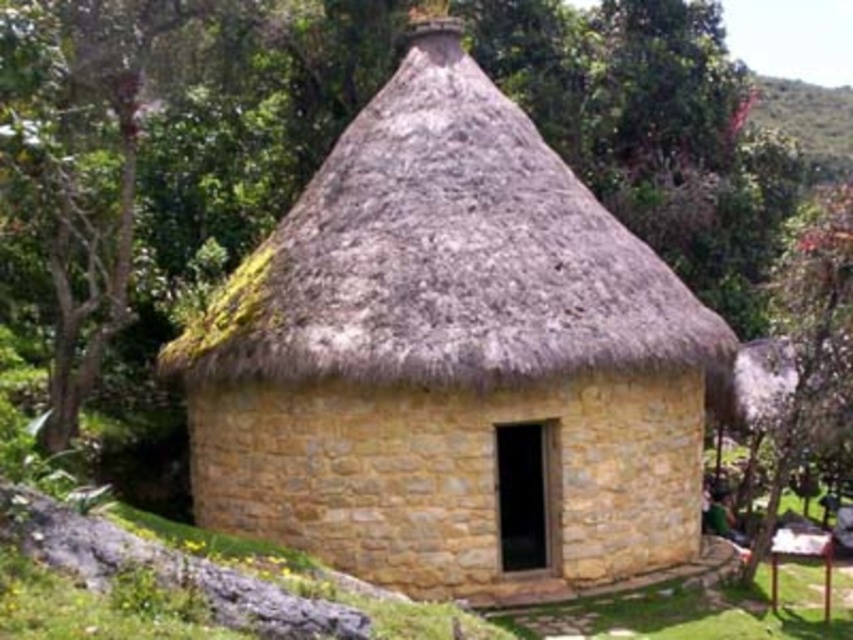
Question: Can you confirm if yellow stone hut at center is positioned above green leafy tree at upper right?

Choices:
 (A) no
 (B) yes

Answer: (A)

Question: In this image, where is yellow stone hut at center located relative to green leafy tree at upper right?

Choices:
 (A) left
 (B) right

Answer: (A)

Question: Does yellow stone hut at center have a greater width compared to green leafy tree at upper right?

Choices:
 (A) yes
 (B) no

Answer: (B)